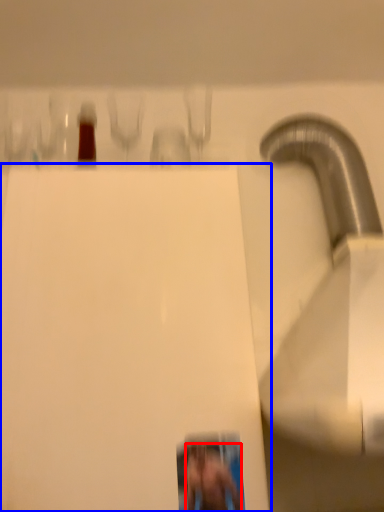
Question: Which of the following is the closest to the observer, person (highlighted by a red box) or wide (highlighted by a blue box)?

Choices:
 (A) person
 (B) wide

Answer: (B)